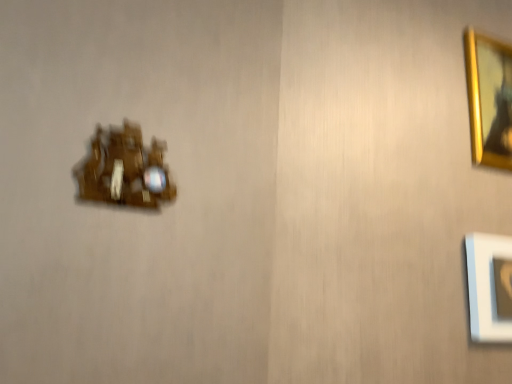
Question: Are gold metallic picture frame at upper right and wooden clock at left located far from each other?

Choices:
 (A) yes
 (B) no

Answer: (B)

Question: Is gold metallic picture frame at upper right smaller than wooden clock at left?

Choices:
 (A) no
 (B) yes

Answer: (A)

Question: Is gold metallic picture frame at upper right outside of wooden clock at left?

Choices:
 (A) yes
 (B) no

Answer: (A)

Question: Is wooden clock at left at the back of gold metallic picture frame at upper right?

Choices:
 (A) no
 (B) yes

Answer: (A)

Question: Does gold metallic picture frame at upper right have a greater height compared to wooden clock at left?

Choices:
 (A) no
 (B) yes

Answer: (B)

Question: Does gold metallic picture frame at upper right touch wooden clock at left?

Choices:
 (A) yes
 (B) no

Answer: (B)

Question: From a real-world perspective, is wooden clock at left on gold metallic picture frame at upper right?

Choices:
 (A) no
 (B) yes

Answer: (A)

Question: Is wooden clock at left bigger than gold metallic picture frame at upper right?

Choices:
 (A) no
 (B) yes

Answer: (A)

Question: Does wooden clock at left appear on the right side of gold metallic picture frame at upper right?

Choices:
 (A) yes
 (B) no

Answer: (B)

Question: Is gold metallic picture frame at upper right surrounded by wooden clock at left?

Choices:
 (A) no
 (B) yes

Answer: (A)

Question: From the image's perspective, is wooden clock at left beneath gold metallic picture frame at upper right?

Choices:
 (A) yes
 (B) no

Answer: (A)

Question: Is wooden clock at left shorter than gold metallic picture frame at upper right?

Choices:
 (A) yes
 (B) no

Answer: (A)

Question: From the image's perspective, relative to wooden clock at left, is gold metallic picture frame at upper right above or below?

Choices:
 (A) above
 (B) below

Answer: (A)